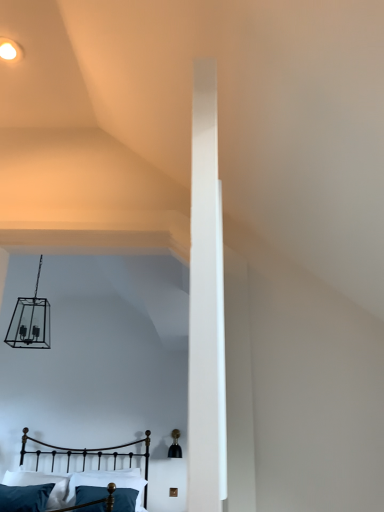
Question: Based on their sizes in the image, would you say matte white ceiling light at upper left is bigger or smaller than metallic black bed at lower left?

Choices:
 (A) small
 (B) big

Answer: (A)

Question: From the image's perspective, is matte white ceiling light at upper left positioned above or below metallic black bed at lower left?

Choices:
 (A) above
 (B) below

Answer: (A)

Question: Estimate the real-world distances between objects in this image. Which object is closer to the velvety teal pillow at lower left, which is the second pillow in right-to-left order?

Choices:
 (A) metallic black bed at lower left
 (B) teal fabric pillow at lower center, acting as the 1th pillow starting from the right
 (C) matte white ceiling light at upper left

Answer: (A)

Question: Considering the real-world distances, which object is closest to the matte white ceiling light at upper left?

Choices:
 (A) teal fabric pillow at lower center, acting as the 1th pillow starting from the right
 (B) metallic black bed at lower left
 (C) velvety teal pillow at lower left, which is counted as the first pillow, starting from the left

Answer: (A)